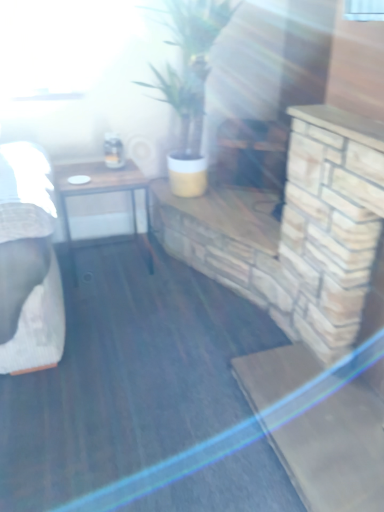
Question: Considering the relative positions of wooden table at left and green matte plant at center in the image provided, is wooden table at left in front of green matte plant at center?

Choices:
 (A) no
 (B) yes

Answer: (A)

Question: Can you confirm if wooden table at left is positioned to the left of green matte plant at center?

Choices:
 (A) yes
 (B) no

Answer: (A)

Question: Does wooden table at left have a lesser width compared to green matte plant at center?

Choices:
 (A) yes
 (B) no

Answer: (A)

Question: Is wooden table at left aimed at green matte plant at center?

Choices:
 (A) no
 (B) yes

Answer: (A)

Question: Can you confirm if wooden table at left is positioned to the right of green matte plant at center?

Choices:
 (A) yes
 (B) no

Answer: (B)

Question: Can you confirm if wooden table at left is wider than green matte plant at center?

Choices:
 (A) no
 (B) yes

Answer: (A)

Question: Is green matte plant at center turned away from wooden table at left?

Choices:
 (A) no
 (B) yes

Answer: (A)

Question: Considering the relative sizes of green matte plant at center and wooden table at left in the image provided, is green matte plant at center thinner than wooden table at left?

Choices:
 (A) yes
 (B) no

Answer: (B)

Question: Does green matte plant at center lie behind wooden table at left?

Choices:
 (A) yes
 (B) no

Answer: (B)

Question: Is green matte plant at center outside wooden table at left?

Choices:
 (A) no
 (B) yes

Answer: (B)

Question: From the image's perspective, does green matte plant at center appear higher than wooden table at left?

Choices:
 (A) no
 (B) yes

Answer: (B)

Question: From a real-world perspective, is green matte plant at center positioned under wooden table at left based on gravity?

Choices:
 (A) no
 (B) yes

Answer: (A)

Question: Is wooden table at left bigger or smaller than green matte plant at center?

Choices:
 (A) big
 (B) small

Answer: (B)